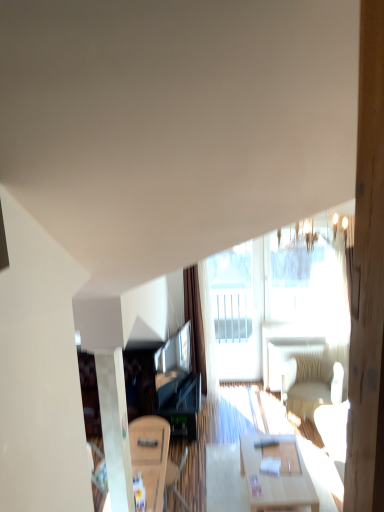
Question: Can you confirm if light wood table at center, the second table positioned from the left, is wider than transparent glass window at upper center?

Choices:
 (A) yes
 (B) no

Answer: (A)

Question: Is light wood table at center, the 1th table when ordered from right to left, positioned far away from transparent glass window at upper center?

Choices:
 (A) no
 (B) yes

Answer: (B)

Question: From the image's perspective, is light wood table at center, the 1th table when ordered from right to left, located beneath transparent glass window at upper center?

Choices:
 (A) yes
 (B) no

Answer: (A)

Question: Does light wood table at center, the 1th table when ordered from right to left, have a smaller size compared to transparent glass window at upper center?

Choices:
 (A) no
 (B) yes

Answer: (A)

Question: Is light wood table at center, the 1th table when ordered from right to left, oriented away from transparent glass window at upper center?

Choices:
 (A) no
 (B) yes

Answer: (A)

Question: Is light wood table at center, the second table positioned from the left, outside transparent glass window at upper center?

Choices:
 (A) no
 (B) yes

Answer: (B)

Question: Is transparent glass door at center outside of light wood table at center, the 1th table when ordered from right to left?

Choices:
 (A) yes
 (B) no

Answer: (A)

Question: Is transparent glass door at center smaller than light wood table at center, the second table positioned from the left?

Choices:
 (A) no
 (B) yes

Answer: (B)

Question: Considering the relative sizes of transparent glass door at center and light wood table at center, the second table positioned from the left, in the image provided, is transparent glass door at center bigger than light wood table at center, the second table positioned from the left,?

Choices:
 (A) no
 (B) yes

Answer: (A)

Question: Can you confirm if transparent glass door at center is thinner than light wood table at center, the second table positioned from the left?

Choices:
 (A) no
 (B) yes

Answer: (B)

Question: Is transparent glass door at center in front of light wood table at center, the second table positioned from the left?

Choices:
 (A) yes
 (B) no

Answer: (B)

Question: From a real-world perspective, is transparent glass door at center positioned under light wood table at center, the 1th table when ordered from right to left, based on gravity?

Choices:
 (A) no
 (B) yes

Answer: (A)

Question: Is transparent glass door at center located within transparent glass window at upper center?

Choices:
 (A) no
 (B) yes

Answer: (A)